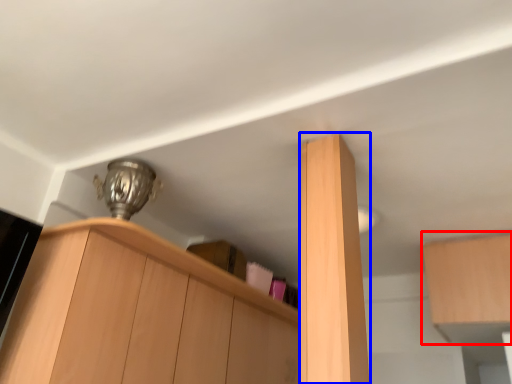
Question: Among these objects, which one is nearest to the camera, cabinetry (highlighted by a red box) or cabinetry (highlighted by a blue box)?

Choices:
 (A) cabinetry
 (B) cabinetry

Answer: (B)